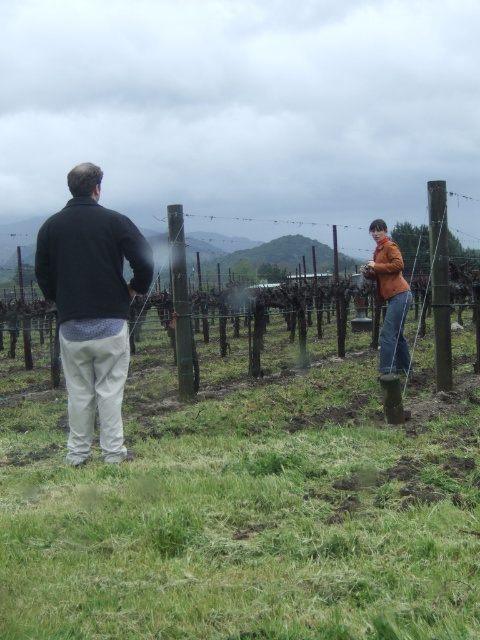
Question: Which point is closer to the camera?

Choices:
 (A) smooth wooden post at center
 (B) green wire fence at center

Answer: (B)

Question: Is orange leather jacket at right to the right of smooth wooden post at center from the viewer's perspective?

Choices:
 (A) no
 (B) yes

Answer: (B)

Question: Which object appears closest to the camera in this image?

Choices:
 (A) brown wooden post at right
 (B) dark gray sweater at left
 (C) smooth wooden post at center

Answer: (B)

Question: Which point is closer to the camera?

Choices:
 (A) dark gray sweater at left
 (B) green wire fence at center
 (C) smooth wooden post at center
 (D) brown wooden post at right

Answer: (A)

Question: Can you confirm if dark gray sweater at left is bigger than orange leather jacket at right?

Choices:
 (A) no
 (B) yes

Answer: (B)

Question: Is dark gray sweater at left above brown wooden post at right?

Choices:
 (A) yes
 (B) no

Answer: (B)